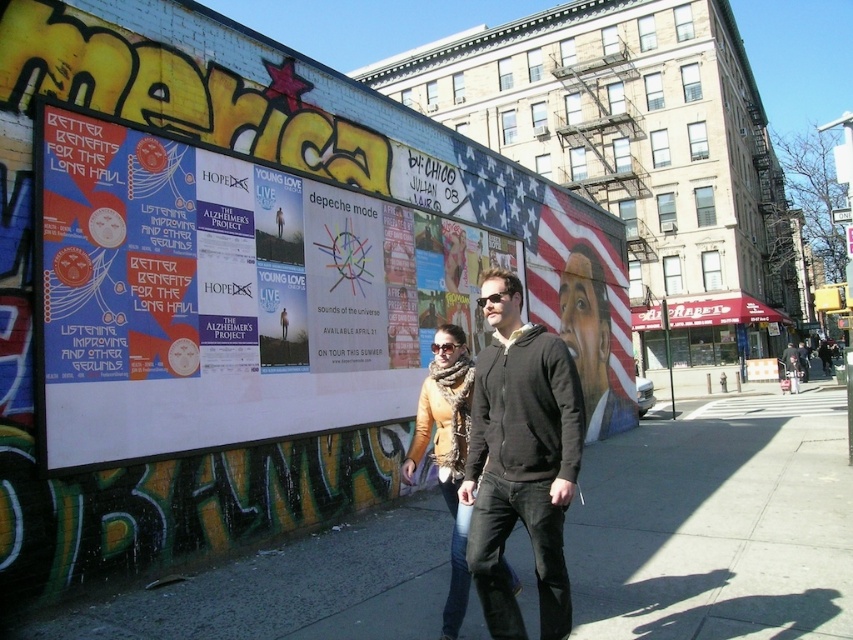
Question: From the image, what is the correct spatial relationship of gray concrete sidewalk at center in relation to orange sweater at center?

Choices:
 (A) above
 (B) below

Answer: (B)

Question: Among these points, which one is nearest to the camera?

Choices:
 (A) (494, 310)
 (B) (712, 547)
 (C) (283, 285)

Answer: (A)

Question: Considering the real-world distances, which object is closest to the orange sweater at center?

Choices:
 (A) matte black hoodie at center
 (B) white paper poster at center

Answer: (A)

Question: Observing the image, what is the correct spatial positioning of white paper poster at center in reference to matte black hoodie at center?

Choices:
 (A) right
 (B) left

Answer: (B)

Question: Does matte black hoodie at center have a greater width compared to orange sweater at center?

Choices:
 (A) yes
 (B) no

Answer: (A)

Question: Estimate the real-world distances between objects in this image. Which object is farther from the white paper poster at center?

Choices:
 (A) gray concrete sidewalk at center
 (B) matte black hoodie at center

Answer: (B)